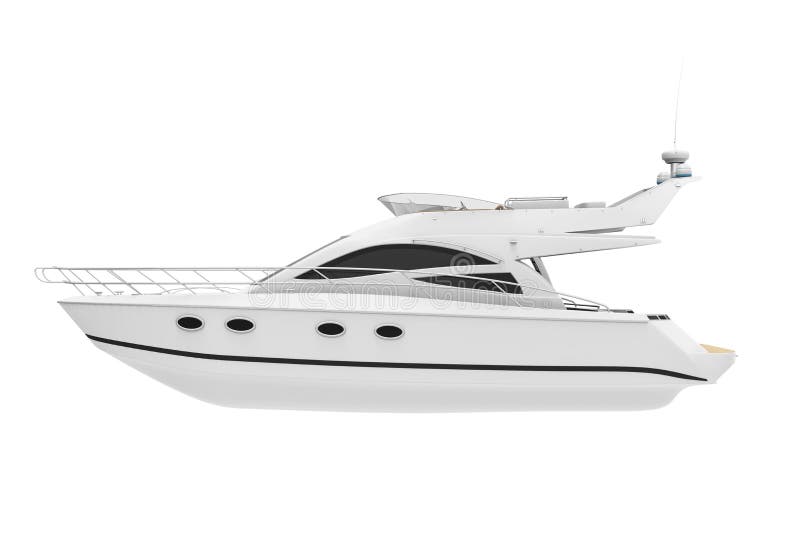
Locate an element on the screen. This screenshot has height=560, width=800. black windows is located at coordinates (393, 253), (346, 272), (306, 272), (474, 284), (502, 270), (508, 282).